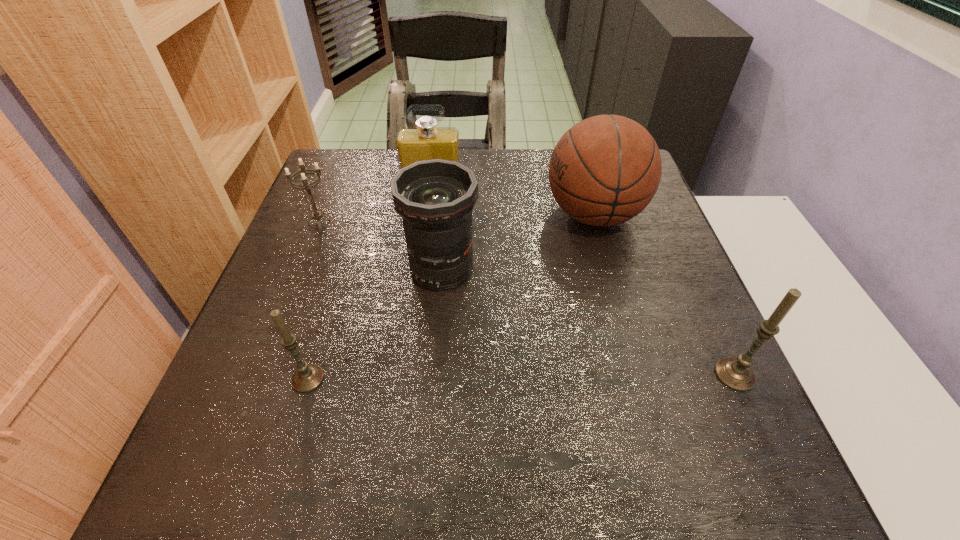
Image resolution: width=960 pixels, height=540 pixels. Find the location of `the shorter candle`. the shorter candle is located at coordinates (307, 377).

Where is `the fifth object from right to left`? This screenshot has height=540, width=960. the fifth object from right to left is located at coordinates (307, 377).

At what (x,y) coordinates should I click in order to perform the action: click on the right candle. Please return your answer as a coordinate pair (x, y). Looking at the image, I should click on (736, 374).

This screenshot has width=960, height=540. I want to click on the rightmost object, so click(x=736, y=374).

Find the location of a particular element. The width and height of the screenshot is (960, 540). the fifth object from left to right is located at coordinates (606, 169).

The image size is (960, 540). What are the coordinates of `perfume` in the screenshot? It's located at (426, 141).

The width and height of the screenshot is (960, 540). Identify the location of candle holder. (317, 215).

In order to click on the leftmost object in this screenshot , I will do `click(317, 215)`.

Locate an element on the screen. This screenshot has height=540, width=960. telephoto lens is located at coordinates (435, 198).

Where is `vacant area situated on the front of the left candle`? vacant area situated on the front of the left candle is located at coordinates (294, 426).